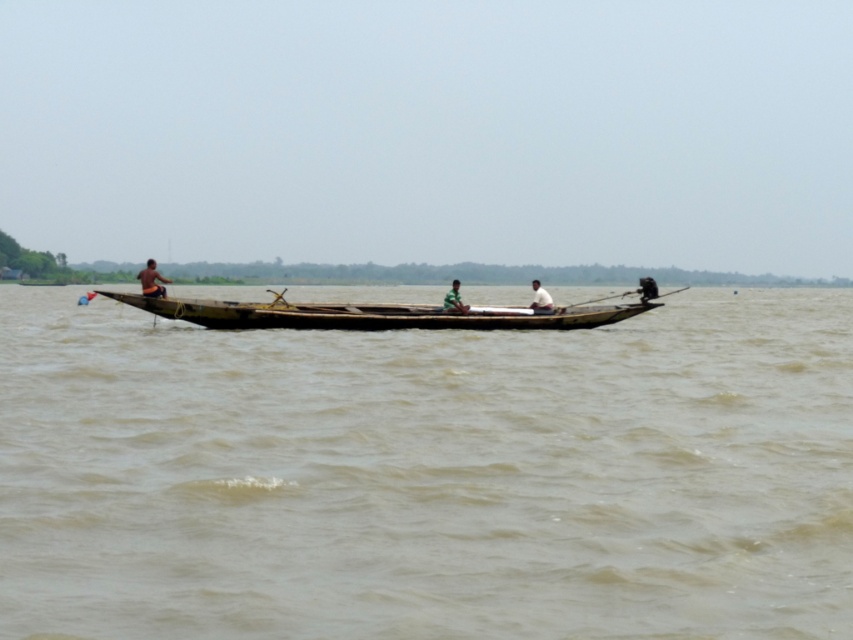
You are standing on the dock and want to throw a lifebuoy to someone on the brown wooden boat at left. The lifebuoy can travel 5 meters. Will it reach the white fabric shirt at center?

The distance between the brown wooden boat at left and the white fabric shirt at center is 6.65 meters. Since the lifebuoy can only travel 5 meters, it will not reach the white fabric shirt at center.

You are standing on the shore of the river and see two points on the boat. The first point is at coordinates point (537, 300) and the second point is at point (447, 305). Which point is closer to the front of the boat?

Point (447, 305) is closer to the front of the boat because point (537, 300) is behind it.

You are standing on the riverbank and see the brown wooden boat at left and the white fabric shirt at center. Which object is wider?

The brown wooden boat at left is wider than the white fabric shirt at center.